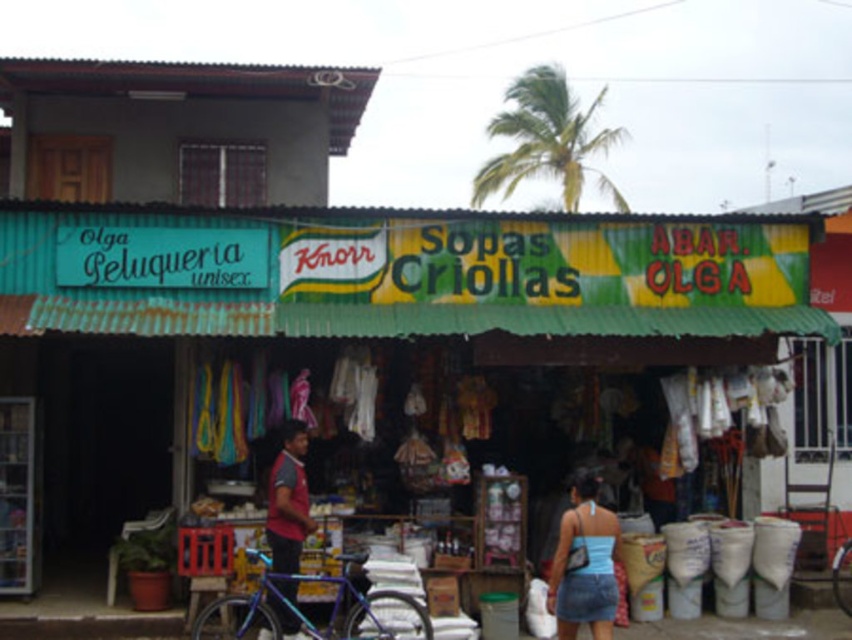
You are a customer in the store and want to know where the blue denim skirt at lower right is located relative to the red fabric shirt at center. Can you tell me?

The blue denim skirt at lower right is located to the right of the red fabric shirt at center.

You are a customer entering the store and want to locate the teal painted wood peluqueria sign at upper left. Based on the coordinates provided, where would you look relative to the entrance?

The teal painted wood peluqueria sign at upper left is located at coordinates point [133,288], which places it at the upper left area of the image, so you should look towards the upper left direction from the entrance to find it.

Consider the image. You are a customer standing at the entrance of the store and want to pick up the red fabric shirt at center and the blue metallic bicycle at center. Can you reach both items without moving more than 5 meters from your starting position?

The distance between the red fabric shirt at center and blue metallic bicycle at center is 6.29 meters. Since you can only move 5 meters from your starting position, you cannot reach both items without exceeding the distance limit.